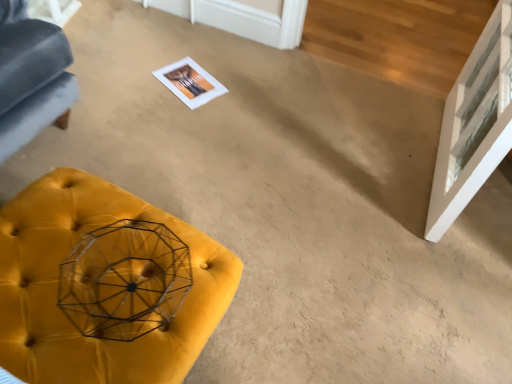
Question: Is transparent glass door at upper right wider or thinner than velvet yellow ottoman at lower left?

Choices:
 (A) wide
 (B) thin

Answer: (B)

Question: Is transparent glass door at upper right situated inside velvet yellow ottoman at lower left or outside?

Choices:
 (A) outside
 (B) inside

Answer: (A)

Question: Considering the relative positions of transparent glass door at upper right and velvet yellow ottoman at lower left in the image provided, is transparent glass door at upper right to the left or to the right of velvet yellow ottoman at lower left?

Choices:
 (A) left
 (B) right

Answer: (B)

Question: Is velvet yellow ottoman at lower left in front of or behind transparent glass door at upper right in the image?

Choices:
 (A) front
 (B) behind

Answer: (A)

Question: Considering the positions of velvet yellow ottoman at lower left and transparent glass door at upper right in the image, is velvet yellow ottoman at lower left bigger or smaller than transparent glass door at upper right?

Choices:
 (A) small
 (B) big

Answer: (A)

Question: Is point (40, 211) closer or farther from the camera than point (442, 203)?

Choices:
 (A) farther
 (B) closer

Answer: (B)

Question: Is velvet yellow ottoman at lower left to the left or to the right of transparent glass door at upper right in the image?

Choices:
 (A) right
 (B) left

Answer: (B)